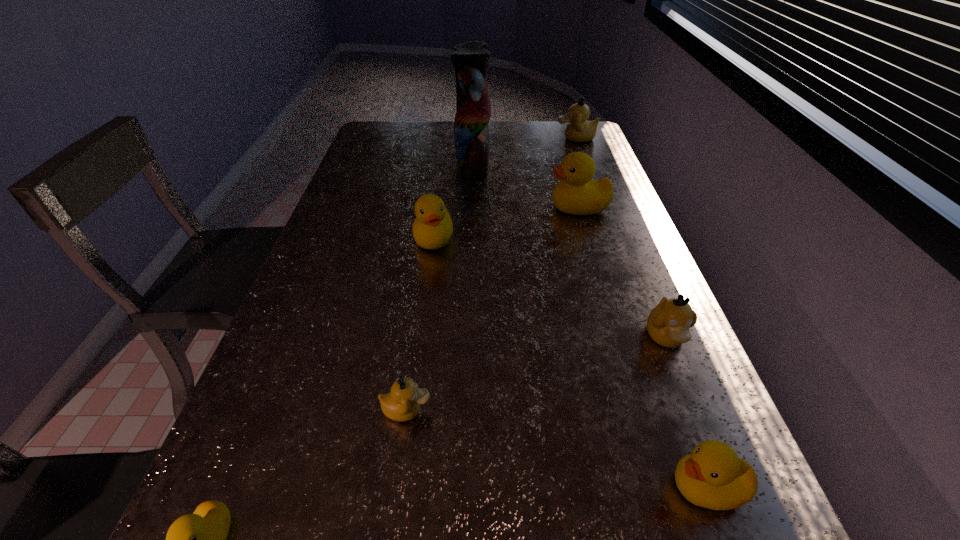
You are a GUI agent. You are given a task and a screenshot of the screen. Output one action in this format:
    pyautogui.click(x=<x>, y=<y>)
    Task: Click on the nearest tan duckling
    
    Given the screenshot: What is the action you would take?
    pyautogui.click(x=402, y=404)

Where is `the smallest tan duckling`? the smallest tan duckling is located at coordinates (402, 404).

You are a GUI agent. You are given a task and a screenshot of the screen. Output one action in this format:
    pyautogui.click(x=<x>, y=<y>)
    Task: Click on the free spot located 0.200m at the face of the parrot
    This screenshot has height=540, width=960.
    Given the screenshot: What is the action you would take?
    pyautogui.click(x=549, y=161)

Identify the location of vacant space located on the face of the farthest yellow duckling. The image size is (960, 540). (471, 207).

Where is `vacant space located 0.130m on the face of the farthest yellow duckling`? vacant space located 0.130m on the face of the farthest yellow duckling is located at coordinates (502, 207).

At what (x,y) coordinates should I click in order to perform the action: click on vacant point located 0.400m on the face of the farthest yellow duckling. Please return your answer as a coordinate pair (x, y). Image resolution: width=960 pixels, height=540 pixels. Looking at the image, I should click on (409, 207).

In order to click on free spot located 0.080m on the face of the biggest tan duckling in this screenshot , I will do `click(534, 138)`.

Where is `free region located on the face of the biggest tan duckling`? Image resolution: width=960 pixels, height=540 pixels. free region located on the face of the biggest tan duckling is located at coordinates (507, 138).

You are a GUI agent. You are given a task and a screenshot of the screen. Output one action in this format:
    pyautogui.click(x=<x>, y=<y>)
    Task: Click on the free space located 0.240m on the face of the biggest tan duckling
    The width and height of the screenshot is (960, 540).
    Given the screenshot: What is the action you would take?
    pos(491,138)

This screenshot has width=960, height=540. Find the location of `free spot located on the face of the third farthest duckling`. free spot located on the face of the third farthest duckling is located at coordinates (430, 269).